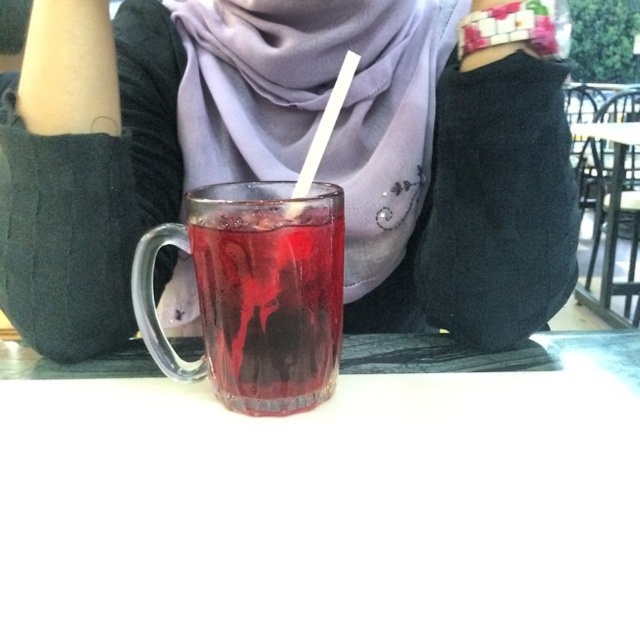
Question: Is matte purple scarf at center to the left of transparent glass table at center from the viewer's perspective?

Choices:
 (A) no
 (B) yes

Answer: (B)

Question: Which object is closer to the camera taking this photo?

Choices:
 (A) transparent glass at center
 (B) transparent glass table at center
 (C) white plastic straw at center
 (D) matte purple scarf at center

Answer: (A)

Question: Is matte purple scarf at center wider than white plastic straw at center?

Choices:
 (A) no
 (B) yes

Answer: (B)

Question: Which of the following is the farthest from the observer?

Choices:
 (A) matte glass mug at center
 (B) transparent glass at center
 (C) transparent glass table at center
 (D) white plastic straw at center

Answer: (C)

Question: Is the position of matte glass mug at center more distant than that of white plastic straw at center?

Choices:
 (A) no
 (B) yes

Answer: (B)

Question: Which object appears closest to the camera in this image?

Choices:
 (A) transparent glass table at center
 (B) transparent glass at center

Answer: (B)